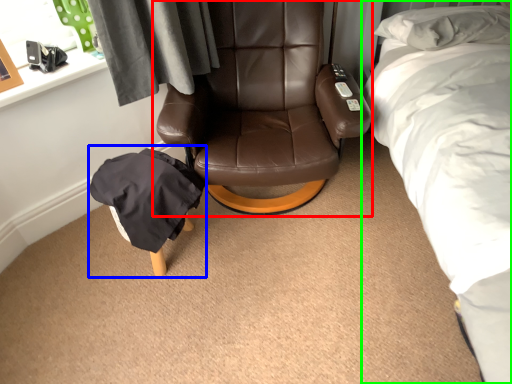
Question: Which object is positioned closest to chair (highlighted by a red box)? Select from bean bag chair (highlighted by a blue box) and bed (highlighted by a green box).

Choices:
 (A) bean bag chair
 (B) bed

Answer: (A)